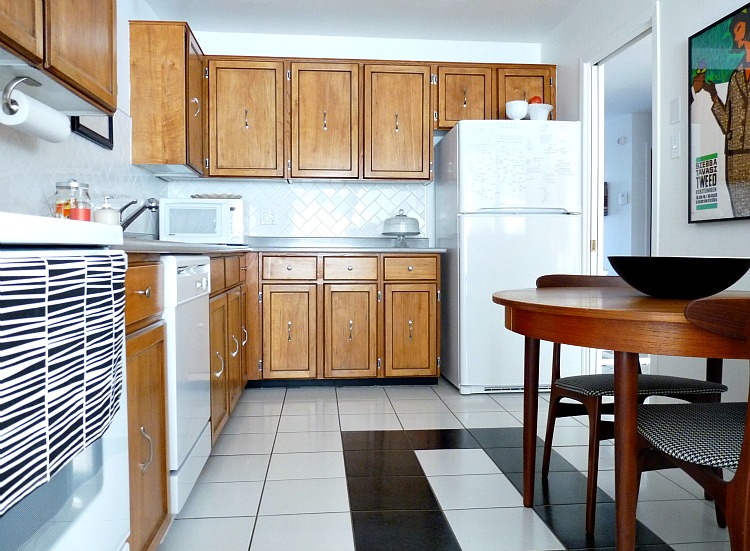
Find the location of `oven`. oven is located at coordinates (34, 408).